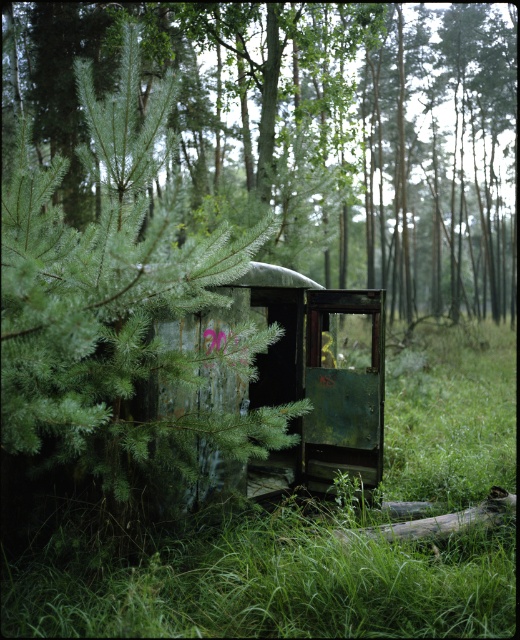
Question: Which of the following is the closest to the observer?

Choices:
 (A) (46, 576)
 (B) (348, 336)
 (C) (487, 157)

Answer: (A)

Question: Which is nearer to the green grassy at center?

Choices:
 (A) green matte tree at center
 (B) green weathered train car at center

Answer: (B)

Question: Can you confirm if green grassy at center is positioned to the left of green weathered train car at center?

Choices:
 (A) no
 (B) yes

Answer: (A)

Question: Which object is farther from the camera taking this photo?

Choices:
 (A) green weathered train car at center
 (B) green matte tree at center

Answer: (B)

Question: Observing the image, what is the correct spatial positioning of green grassy at center in reference to green weathered train car at center?

Choices:
 (A) below
 (B) above

Answer: (A)

Question: From the image, what is the correct spatial relationship of green matte tree at center in relation to green grassy at center?

Choices:
 (A) above
 (B) below

Answer: (A)